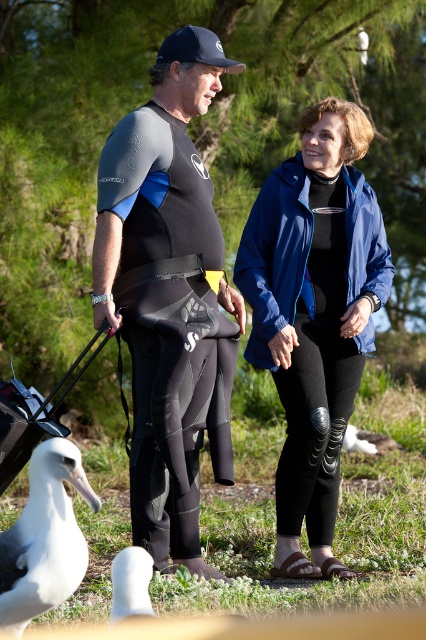
Does blue matte jacket at center come in front of white matte mollymawk at lower left?

No, it is behind white matte mollymawk at lower left.

Between point (374, 285) and point (74, 445), which one is positioned behind?

Point (374, 285)

Find the location of a particular element. blue matte jacket at center is located at coordinates point(313,316).

Is white matte mollymawk at lower left above black rubber baby carriage at lower left?

No.

Does point (49, 458) come behind point (80, 353)?

No, it is not.

Where is `white matte mollymawk at lower left`? The width and height of the screenshot is (426, 640). white matte mollymawk at lower left is located at coordinates (43, 538).

Does point (17, 589) come in front of point (120, 554)?

No, it is behind (120, 554).

Does white matte mollymawk at lower left have a larger size compared to white matte bird at lower left?

Correct, white matte mollymawk at lower left is larger in size than white matte bird at lower left.

Between point (94, 496) and point (124, 570), which one is positioned in front?

Point (124, 570)

Find the location of a particular element. Image resolution: width=426 pixels, height=640 pixels. white matte mollymawk at lower left is located at coordinates (43, 538).